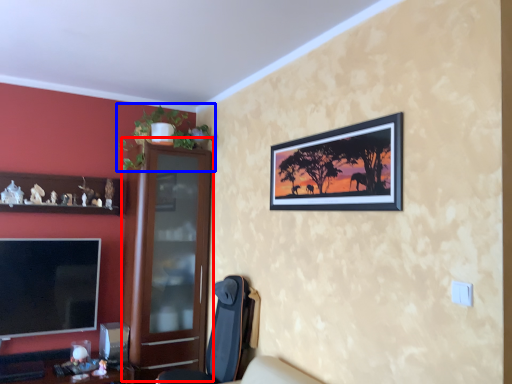
Question: Among these objects, which one is farthest to the camera, dresser (highlighted by a red box) or houseplant (highlighted by a blue box)?

Choices:
 (A) dresser
 (B) houseplant

Answer: (A)